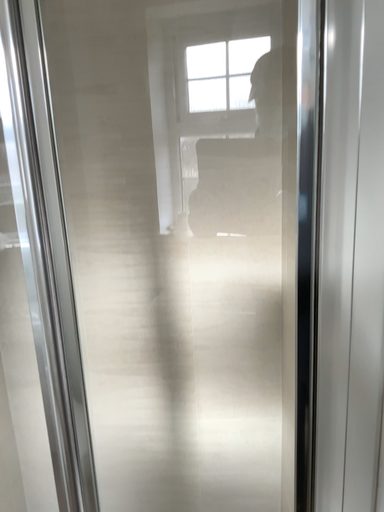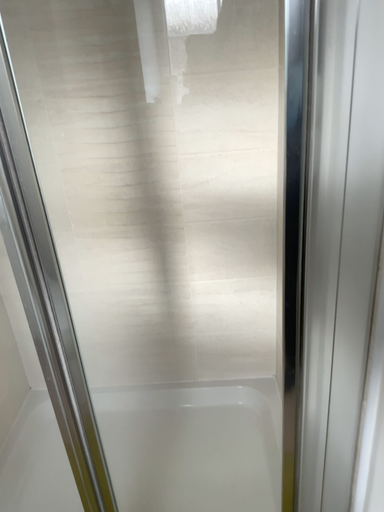
Question: How did the camera likely rotate when shooting the video?

Choices:
 (A) rotated downward
 (B) rotated upward

Answer: (A)